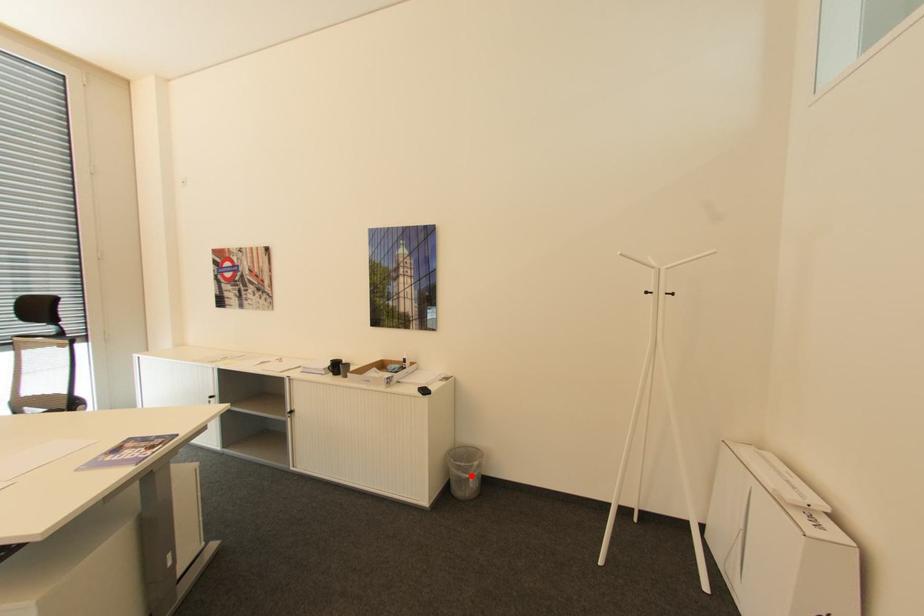
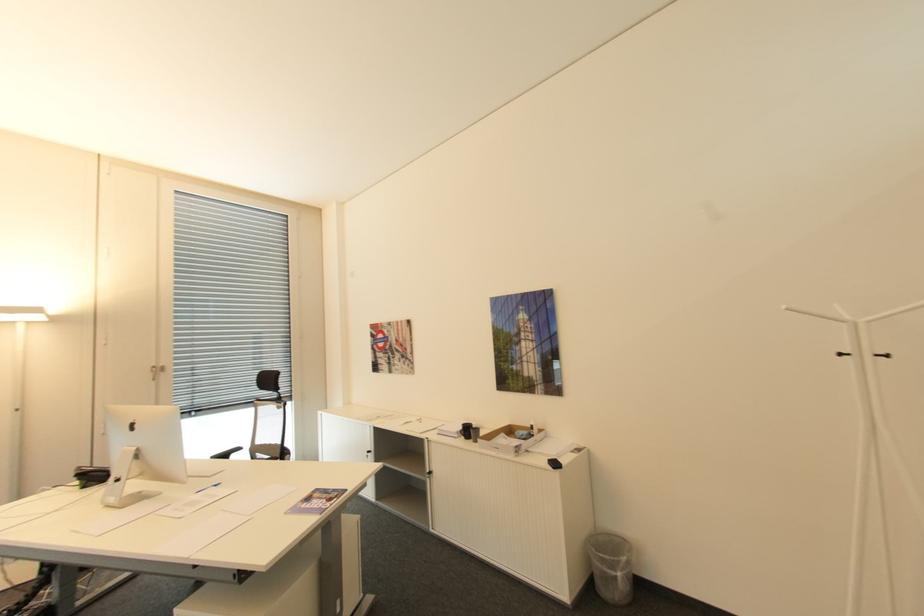
The point at the highlighted location is marked in the first image. Where is the corresponding point in the second image?

(617, 570)